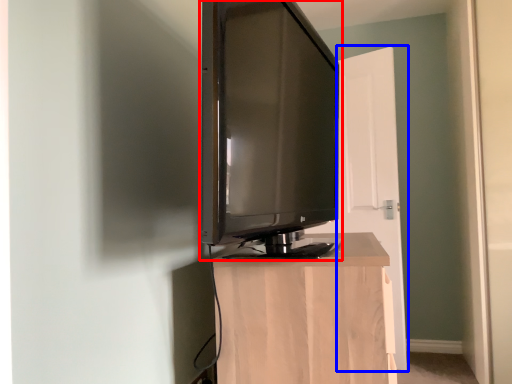
Question: Which of the following is the closest to the observer, television (highlighted by a red box) or door (highlighted by a blue box)?

Choices:
 (A) television
 (B) door

Answer: (A)